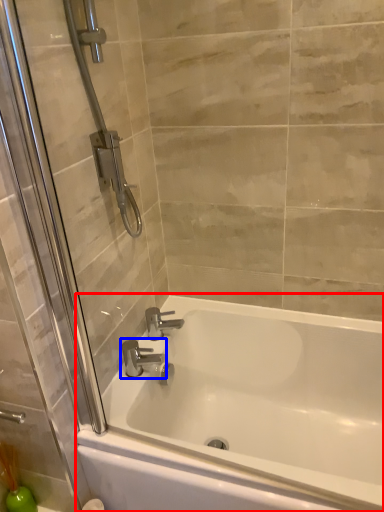
Question: Among these objects, which one is nearest to the camera, bathtub (highlighted by a red box) or tap (highlighted by a blue box)?

Choices:
 (A) bathtub
 (B) tap

Answer: (A)